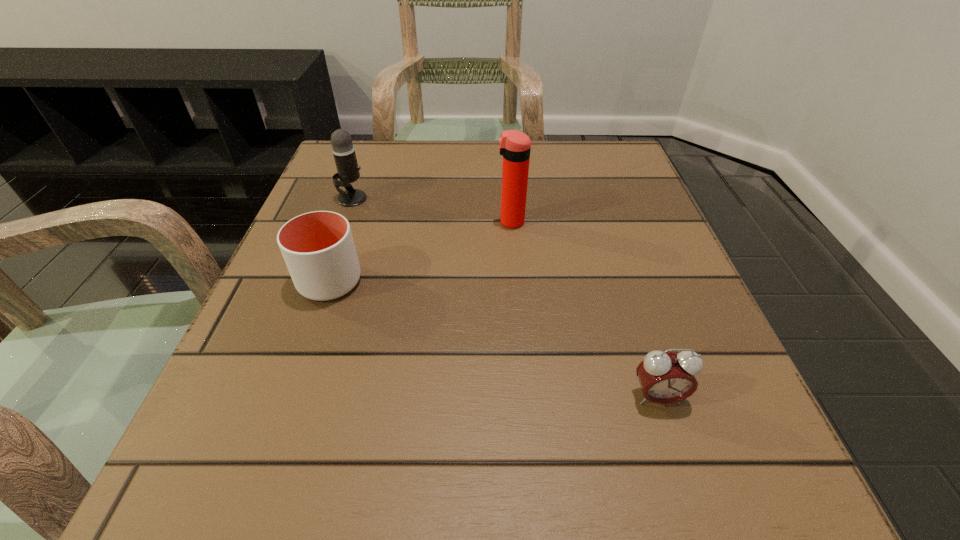
In order to click on thermos bottle in this screenshot , I will do `click(515, 146)`.

Image resolution: width=960 pixels, height=540 pixels. I want to click on the third nearest object, so click(x=515, y=146).

Where is `microphone`? microphone is located at coordinates (343, 150).

Where is `the farthest object`? This screenshot has height=540, width=960. the farthest object is located at coordinates (343, 150).

Locate an element on the screen. the second nearest object is located at coordinates (318, 248).

Locate an element on the screen. the rightmost object is located at coordinates (665, 377).

The image size is (960, 540). Identify the location of alarm clock. (665, 377).

I want to click on blank space located on the front of the thermos bottle, so click(522, 370).

Find the location of a particular element. vacant point located 0.130m on the back of the second tallest object is located at coordinates (367, 159).

This screenshot has width=960, height=540. What are the coordinates of `vacant space located on the right of the second nearest object` in the screenshot? It's located at (x=582, y=281).